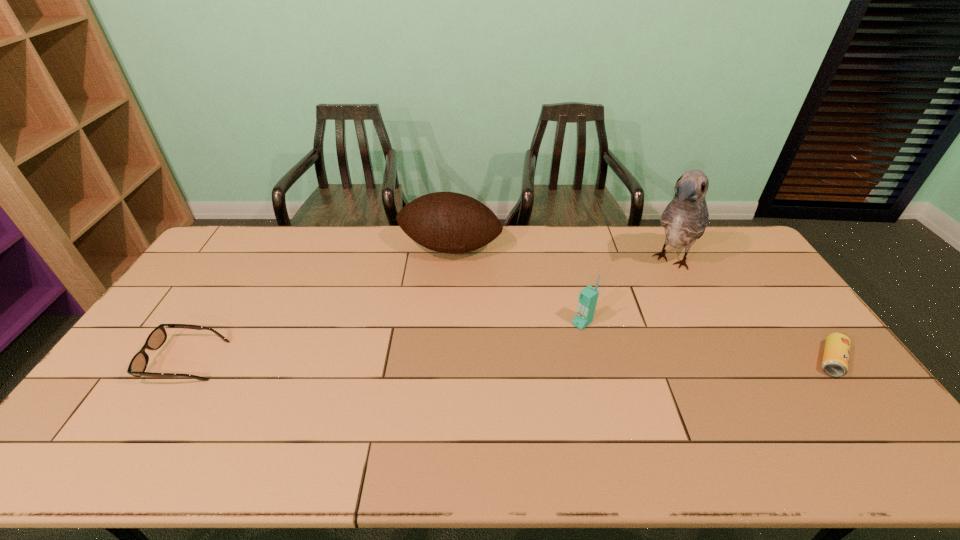
Locate an element on the screen. This screenshot has width=960, height=540. free space located on the front of the rightmost object is located at coordinates (875, 417).

At what (x,y) coordinates should I click in order to perform the action: click on vacant area situated 0.130m on the laces of the fourth object from right to left. Please return your answer as a coordinate pair (x, y). The height and width of the screenshot is (540, 960). Looking at the image, I should click on (432, 292).

You are a GUI agent. You are given a task and a screenshot of the screen. Output one action in this format:
    pyautogui.click(x=<x>, y=<y>)
    Task: Click on the vacant region located on the laces of the fourth object from right to left
    
    Given the screenshot: What is the action you would take?
    pyautogui.click(x=421, y=323)

Where is `vacant region located on the laces of the fourth object from right to left`? vacant region located on the laces of the fourth object from right to left is located at coordinates [x=422, y=321].

This screenshot has height=540, width=960. In order to click on free region located on the front-facing side of the fourth object from left to right in this screenshot , I will do `click(643, 306)`.

You are a GUI agent. You are given a task and a screenshot of the screen. Output one action in this format:
    pyautogui.click(x=<x>, y=<y>)
    Task: Click on the vacant region located 0.090m on the front-facing side of the fourth object from left to right
    Image resolution: width=960 pixels, height=540 pixels.
    Given the screenshot: What is the action you would take?
    pyautogui.click(x=651, y=295)

Identify the location of blank space located 0.120m on the front-facing side of the fourth object from left to right. (647, 300).

The width and height of the screenshot is (960, 540). I want to click on free space located 0.230m on the keypad of the third farthest object, so click(x=522, y=370).

Find the location of `free space located on the keypad of the third farthest object`. free space located on the keypad of the third farthest object is located at coordinates [546, 350].

Find the location of a particular element. vacant space located on the keypad of the third farthest object is located at coordinates (532, 362).